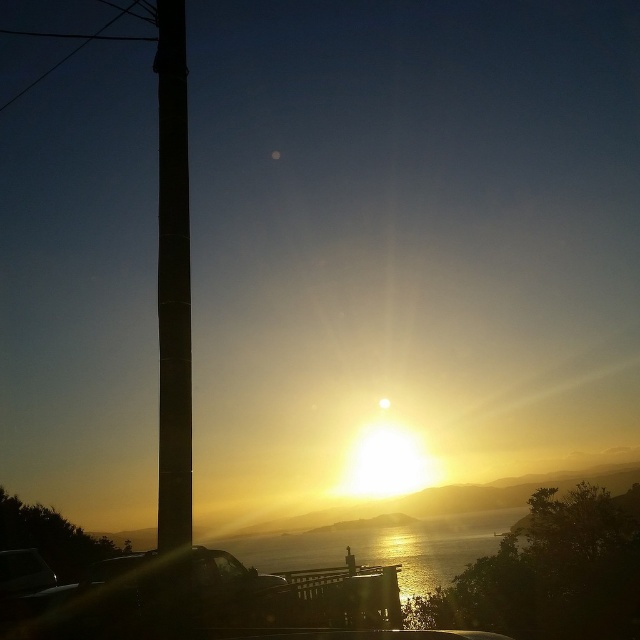
You are driving a car and notice the black smooth pole at left and the transparent glass car window at lower center in your view. Which object takes up more area in your field of view?

The transparent glass car window at lower center takes up more area in your field of view than the black smooth pole at left.

You are driving a car and notice the black smooth pole at left and the transparent glass car window at lower center in your view. Which object is closer to you from your perspective inside the car?

The transparent glass car window at lower center is closer to you because it is at the lower center of your view inside the car, while the black smooth pole at left is positioned over it, indicating it is further away.

You are standing at the center of the image and want to locate the shiny black car at lower left. Which direction should you look to find it?

The shiny black car at lower left is located at point (x=145, y=598), which is to the lower left direction from the center of the image.